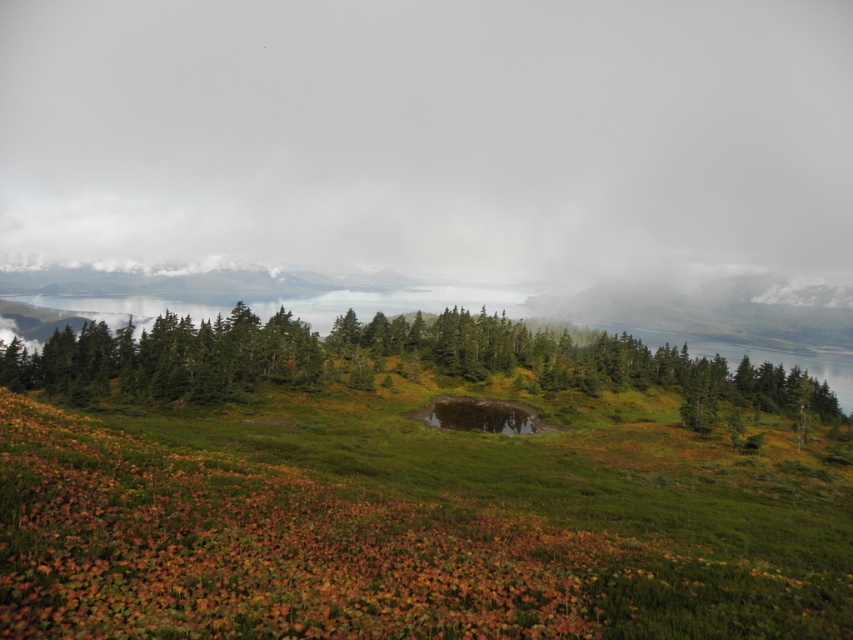
Question: Considering the real-world distances, which object is farthest from the white fluffy cloud at upper center?

Choices:
 (A) green grassy at center
 (B) green matte trees at center

Answer: (A)

Question: Observing the image, what is the correct spatial positioning of white fluffy cloud at upper center in reference to green matte trees at center?

Choices:
 (A) left
 (B) right

Answer: (B)

Question: Is white fluffy cloud at upper center to the left of green matte trees at center from the viewer's perspective?

Choices:
 (A) yes
 (B) no

Answer: (B)

Question: Which object is positioned closest to the green grassy at center?

Choices:
 (A) white fluffy cloud at upper center
 (B) green matte trees at center

Answer: (B)

Question: Which object is farther from the camera taking this photo?

Choices:
 (A) green grassy at center
 (B) white fluffy cloud at upper center
 (C) green matte trees at center

Answer: (B)

Question: Can you confirm if white fluffy cloud at upper center is positioned to the right of green matte trees at center?

Choices:
 (A) yes
 (B) no

Answer: (A)